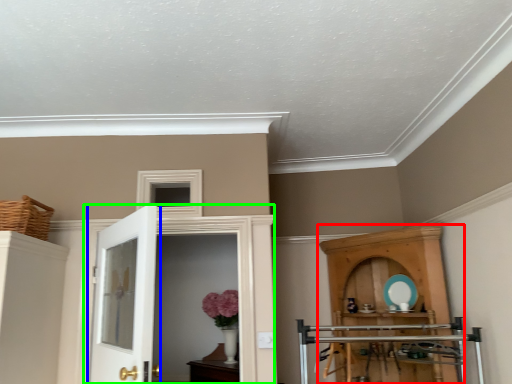
Question: Considering the real-world distances, which object is farthest from cupboard (highlighted by a red box)? door (highlighted by a blue box) or door (highlighted by a green box)?

Choices:
 (A) door
 (B) door

Answer: (A)